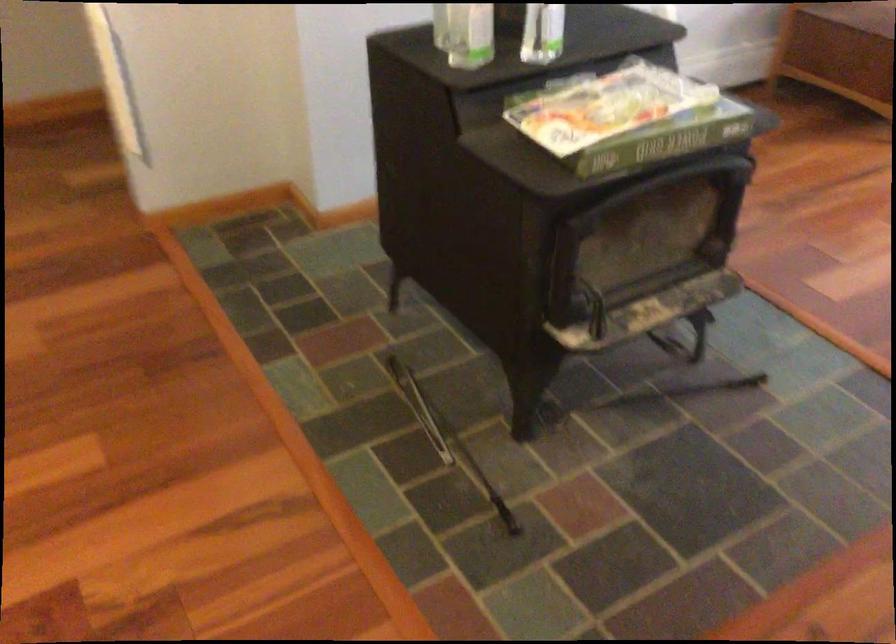
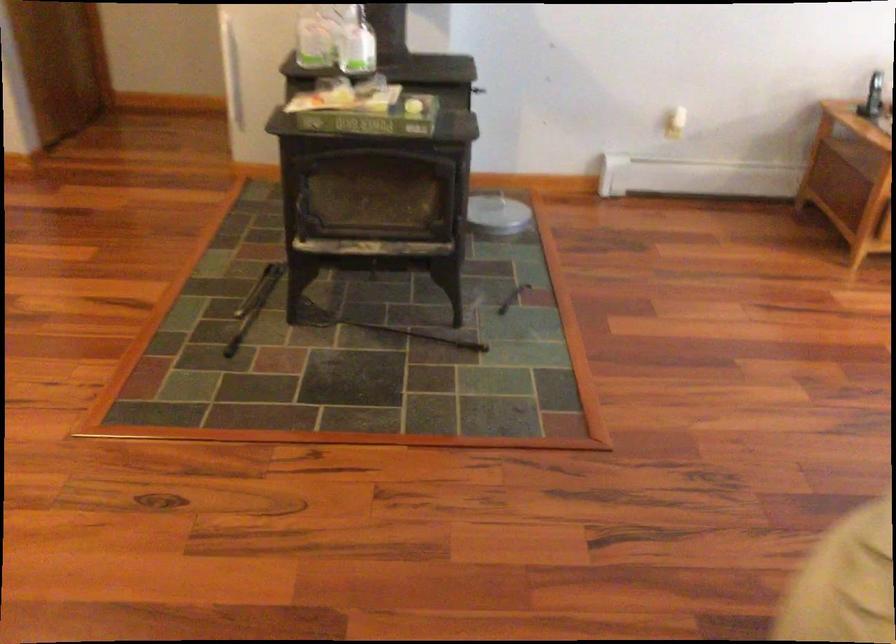
Find the pixel in the second image that matches (x=437, y=428) in the first image.

(254, 305)